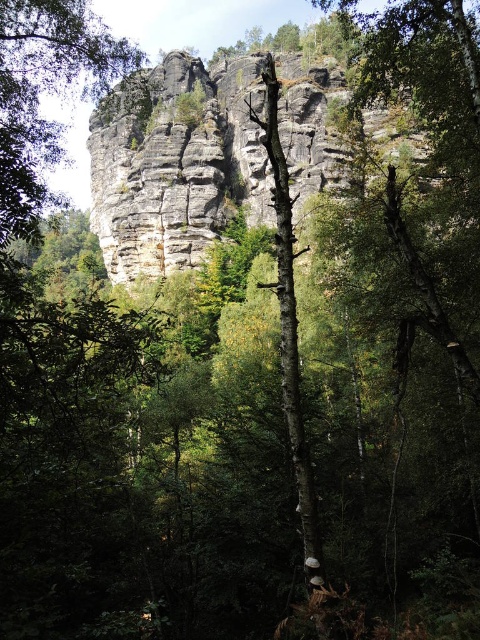
Question: From the image, what is the correct spatial relationship of gray rock formation at center in relation to rough textured rock at upper center?

Choices:
 (A) above
 (B) below

Answer: (A)

Question: Can you confirm if gray rock formation at center is smaller than rough textured rock at upper center?

Choices:
 (A) yes
 (B) no

Answer: (B)

Question: Which point is closer to the camera?

Choices:
 (A) (112, 68)
 (B) (169, 100)

Answer: (A)

Question: Which point is farther from the camera taking this photo?

Choices:
 (A) (244, 200)
 (B) (36, 186)

Answer: (A)

Question: Which point appears farthest from the camera in this image?

Choices:
 (A) (176, 216)
 (B) (50, 56)

Answer: (A)

Question: Is gray rock formation at center below rough textured rock at upper center?

Choices:
 (A) no
 (B) yes

Answer: (A)